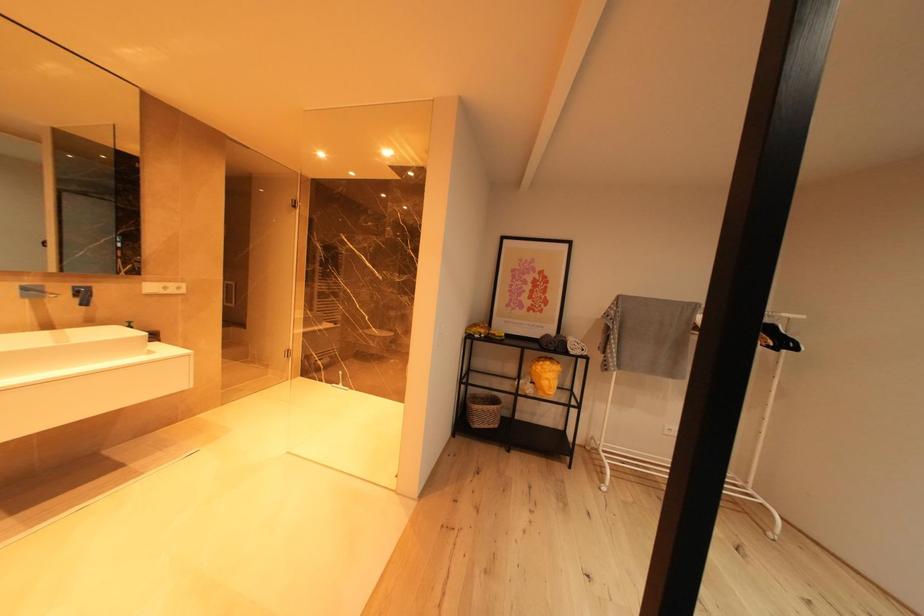
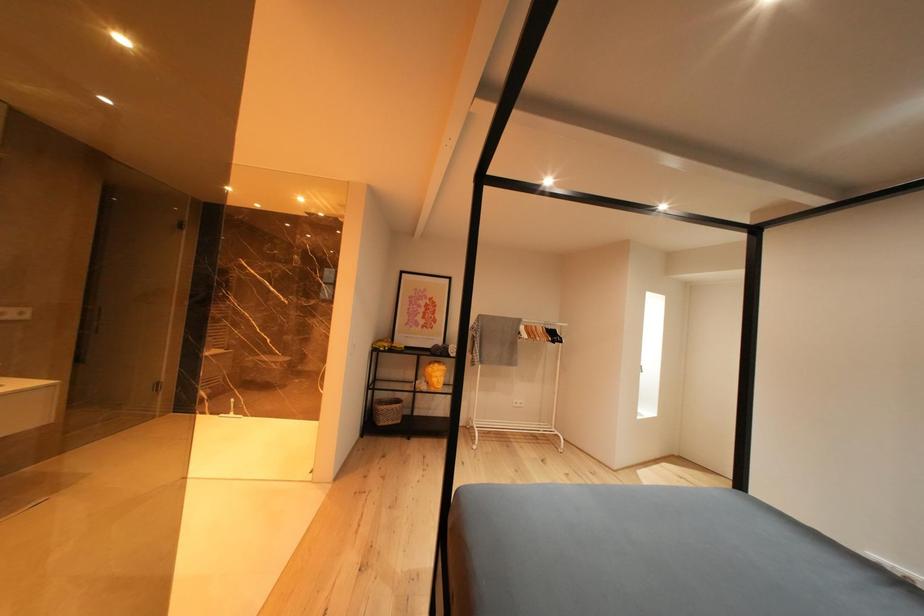
Question: How did the camera likely rotate?

Choices:
 (A) Left
 (B) Right
 (C) Up
 (D) Down

Answer: (B)